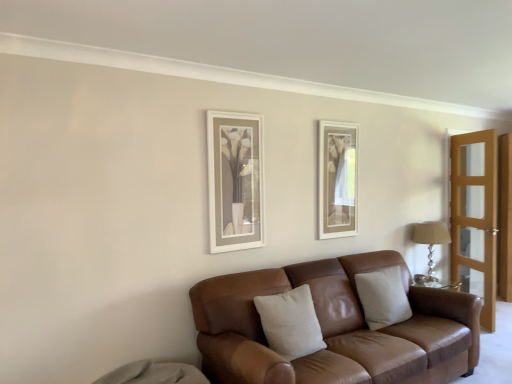
What is the approximate height of silver glass table lamp at right?

The height of silver glass table lamp at right is 23.33 inches.

Based on the photo, measure the distance between beige cotton pillow at center, which is the second pillow from right to left, and camera.

The distance of beige cotton pillow at center, which is the second pillow from right to left, from camera is 2.62 meters.

Where is `beige leather pillow at center, which ranks as the first pillow in back-to-front order`? This screenshot has height=384, width=512. beige leather pillow at center, which ranks as the first pillow in back-to-front order is located at coordinates (383, 297).

Find the location of `table lamp lying on the right of beige cotton pillow at center, the 1th pillow when ordered from left to right`. table lamp lying on the right of beige cotton pillow at center, the 1th pillow when ordered from left to right is located at coordinates (431, 240).

Which object is thinner, silver glass table lamp at right or beige cotton pillow at center, which is the second pillow from right to left?

beige cotton pillow at center, which is the second pillow from right to left, is thinner.

Which of these two, silver glass table lamp at right or beige cotton pillow at center, positioned as the 2th pillow in back-to-front order, stands taller?

beige cotton pillow at center, positioned as the 2th pillow in back-to-front order.

Is silver glass table lamp at right turned away from light brown wooden screen door at right?

silver glass table lamp at right is not turned away from light brown wooden screen door at right.

Can you see silver glass table lamp at right touching light brown wooden screen door at right?

No, silver glass table lamp at right is not touching light brown wooden screen door at right.

Does brown leather couch at center turn towards beige cotton pillow at center, which is the 1th pillow in front-to-back order?

Yes, brown leather couch at center is facing beige cotton pillow at center, which is the 1th pillow in front-to-back order.

Is brown leather couch at center behind beige cotton pillow at center, positioned as the 2th pillow in back-to-front order?

No, brown leather couch at center is in front of beige cotton pillow at center, positioned as the 2th pillow in back-to-front order.

Looking at this image, which of these two, brown leather couch at center or beige cotton pillow at center, positioned as the 2th pillow in back-to-front order, is thinner?

beige cotton pillow at center, positioned as the 2th pillow in back-to-front order.

Considering the positions of objects brown leather couch at center and beige cotton pillow at center, positioned as the 2th pillow in back-to-front order, in the image provided, who is more to the left, brown leather couch at center or beige cotton pillow at center, positioned as the 2th pillow in back-to-front order,?

From the viewer's perspective, beige cotton pillow at center, positioned as the 2th pillow in back-to-front order, appears more on the left side.

From the image's perspective, which one is positioned higher, beige cotton pillow at center, the 1th pillow when ordered from left to right, or brown leather couch at center?

beige cotton pillow at center, the 1th pillow when ordered from left to right, from the image's perspective.

How much distance is there between beige cotton pillow at center, which is the second pillow from right to left, and brown leather couch at center?

The distance of beige cotton pillow at center, which is the second pillow from right to left, from brown leather couch at center is 14.04 inches.

What are the coordinates of `studio couch below the beige cotton pillow at center, positioned as the 2th pillow in back-to-front order (from the image's perspective)` in the screenshot? It's located at (335, 328).

From a real-world perspective, relative to brown leather couch at center, is beige cotton pillow at center, which is the 1th pillow in front-to-back order, vertically above or below?

In terms of real-world spatial position, beige cotton pillow at center, which is the 1th pillow in front-to-back order, is above brown leather couch at center.

This screenshot has width=512, height=384. I want to click on table lamp above the beige cotton pillow at center, which is the second pillow from right to left (from a real-world perspective), so click(x=431, y=240).

Is beige cotton pillow at center, positioned as the 2th pillow in back-to-front order, next to silver glass table lamp at right?

No, beige cotton pillow at center, positioned as the 2th pillow in back-to-front order, is not next to silver glass table lamp at right.

Looking at the image, does beige cotton pillow at center, positioned as the 2th pillow in back-to-front order, seem bigger or smaller compared to silver glass table lamp at right?

Considering their sizes, beige cotton pillow at center, positioned as the 2th pillow in back-to-front order, takes up more space than silver glass table lamp at right.

Could you tell me if beige cotton pillow at center, which is the 1th pillow in front-to-back order, is turned towards silver glass table lamp at right?

No, beige cotton pillow at center, which is the 1th pillow in front-to-back order, is not oriented towards silver glass table lamp at right.

Looking at the image, does beige leather pillow at center, which ranks as the first pillow in back-to-front order, seem bigger or smaller compared to beige cotton pillow at center, which is the 1th pillow in front-to-back order?

Considering their sizes, beige leather pillow at center, which ranks as the first pillow in back-to-front order, takes up less space than beige cotton pillow at center, which is the 1th pillow in front-to-back order.

Could you tell me if beige leather pillow at center, which ranks as the first pillow in back-to-front order, is turned towards beige cotton pillow at center, the 1th pillow when ordered from left to right?

No, beige leather pillow at center, which ranks as the first pillow in back-to-front order, does not turn towards beige cotton pillow at center, the 1th pillow when ordered from left to right.

What are the coordinates of `pillow located underneath the beige cotton pillow at center, positioned as the 2th pillow in back-to-front order (from a real-world perspective)` in the screenshot? It's located at (383, 297).

Based on the photo, considering the sizes of objects beige leather pillow at center, which ranks as the 1th pillow in right-to-left order, and beige cotton pillow at center, which is the 1th pillow in front-to-back order, in the image provided, who is shorter, beige leather pillow at center, which ranks as the 1th pillow in right-to-left order, or beige cotton pillow at center, which is the 1th pillow in front-to-back order,?

beige leather pillow at center, which ranks as the 1th pillow in right-to-left order, is shorter.

From the image's perspective, does beige leather pillow at center, marked as the second pillow in a front-to-back arrangement, appear higher than silver glass table lamp at right?

No, from the image's perspective, beige leather pillow at center, marked as the second pillow in a front-to-back arrangement, is not over silver glass table lamp at right.

From a real-world perspective, relative to silver glass table lamp at right, is beige leather pillow at center, the 2th pillow viewed from the left, vertically above or below?

From a real-world perspective, beige leather pillow at center, the 2th pillow viewed from the left, is physically below silver glass table lamp at right.

From a real-world perspective, count 1st pillows downward from the silver glass table lamp at right and point to it. Please provide its 2D coordinates.

[(290, 323)]

The height and width of the screenshot is (384, 512). What are the coordinates of `table lamp behind the light brown wooden screen door at right` in the screenshot? It's located at (431, 240).

Considering their positions, is brown leather couch at center positioned further to light brown wooden screen door at right than beige cotton pillow at center, the 1th pillow when ordered from left to right?

Based on the image, beige cotton pillow at center, the 1th pillow when ordered from left to right, appears to be further to light brown wooden screen door at right.

From the image, which object appears to be nearer to light brown wooden screen door at right, beige leather pillow at center, marked as the second pillow in a front-to-back arrangement, or beige cotton pillow at center, which is the 1th pillow in front-to-back order?

Based on the image, beige leather pillow at center, marked as the second pillow in a front-to-back arrangement, appears to be nearer to light brown wooden screen door at right.

Which object lies nearer to the anchor point beige cotton pillow at center, the 1th pillow when ordered from left to right, brown leather couch at center or silver glass table lamp at right?

brown leather couch at center lies closer to beige cotton pillow at center, the 1th pillow when ordered from left to right, than the other object.

Which object lies further to the anchor point light brown wooden screen door at right, beige cotton pillow at center, which is the second pillow from right to left, or silver glass table lamp at right?

beige cotton pillow at center, which is the second pillow from right to left, is positioned further to the anchor light brown wooden screen door at right.

Based on their spatial positions, is silver glass table lamp at right or beige leather pillow at center, the 2th pillow viewed from the left, further from brown leather couch at center?

The object further to brown leather couch at center is silver glass table lamp at right.

When comparing their distances from brown leather couch at center, does silver glass table lamp at right or beige cotton pillow at center, which is the 1th pillow in front-to-back order, seem further?

Among the two, silver glass table lamp at right is located further to brown leather couch at center.

Estimate the real-world distances between objects in this image. Which object is further from light brown wooden screen door at right, brown leather couch at center or silver glass table lamp at right?

brown leather couch at center is further to light brown wooden screen door at right.

In the scene shown: Which object lies nearer to the anchor point beige leather pillow at center, which ranks as the first pillow in back-to-front order, brown leather couch at center or beige cotton pillow at center, positioned as the 2th pillow in back-to-front order?

brown leather couch at center.

You are a GUI agent. You are given a task and a screenshot of the screen. Output one action in this format:
    pyautogui.click(x=<x>, y=<y>)
    Task: Click on the pillow situated between beige cotton pillow at center, which is the 1th pillow in front-to-back order, and light brown wooden screen door at right from left to right
    
    Given the screenshot: What is the action you would take?
    pyautogui.click(x=383, y=297)

Identify the location of screen door located between brown leather couch at center and silver glass table lamp at right in the depth direction. This screenshot has height=384, width=512. (475, 217).

At what (x,y) coordinates should I click in order to perform the action: click on studio couch between beige cotton pillow at center, the 1th pillow when ordered from left to right, and light brown wooden screen door at right, in the horizontal direction. Please return your answer as a coordinate pair (x, y). The width and height of the screenshot is (512, 384). Looking at the image, I should click on (335, 328).

What are the coordinates of `table lamp between beige leather pillow at center, which ranks as the 1th pillow in right-to-left order, and light brown wooden screen door at right, in the horizontal direction` in the screenshot? It's located at coord(431,240).